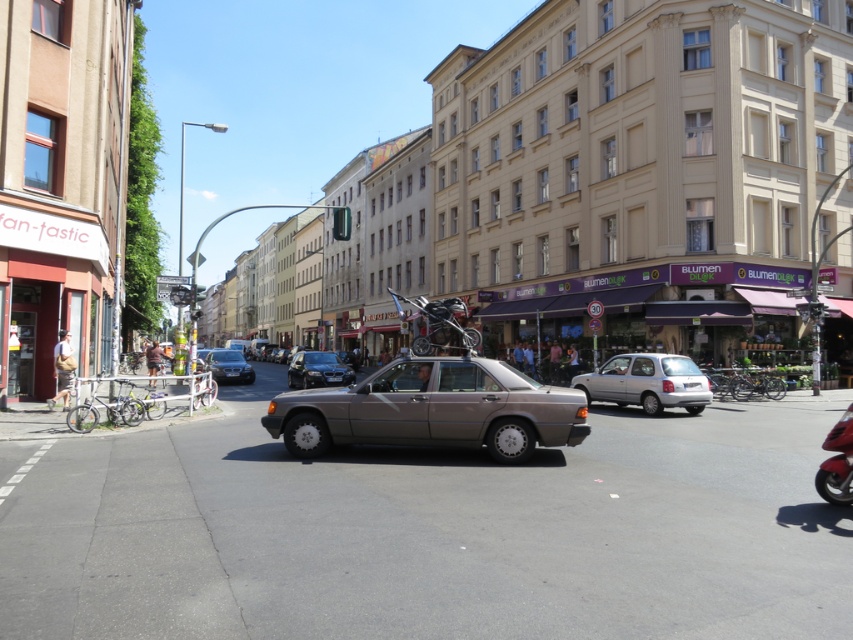
Does point (471, 436) come farther from viewer compared to point (235, 352)?

No, (471, 436) is closer to viewer.

Can you confirm if satin silver car at center is positioned to the right of matte black sedan at center?

Yes, satin silver car at center is to the right of matte black sedan at center.

The width and height of the screenshot is (853, 640). What do you see at coordinates (432, 410) in the screenshot? I see `satin silver car at center` at bounding box center [432, 410].

Locate an element on the screen. This screenshot has width=853, height=640. satin silver car at center is located at coordinates (432, 410).

Can you confirm if satin silver car at center is positioned below shiny red motorcycle at lower right?

No, satin silver car at center is not below shiny red motorcycle at lower right.

Who is more distant from viewer, [413,392] or [828,458]?

Point [413,392]

Does point (389, 420) come behind point (848, 500)?

Yes, point (389, 420) is farther from viewer.

Find the location of a particular element. The height and width of the screenshot is (640, 853). satin silver car at center is located at coordinates (432, 410).

Which is more to the left, satin silver car at center or silver metallic hatchback at center?

From the viewer's perspective, satin silver car at center appears more on the left side.

Is satin silver car at center positioned behind silver metallic hatchback at center?

No, satin silver car at center is closer to the viewer.

Is point (552, 422) farther from viewer compared to point (683, 356)?

No, (552, 422) is in front of (683, 356).

Find the location of `satin silver car at center`. satin silver car at center is located at coordinates (432, 410).